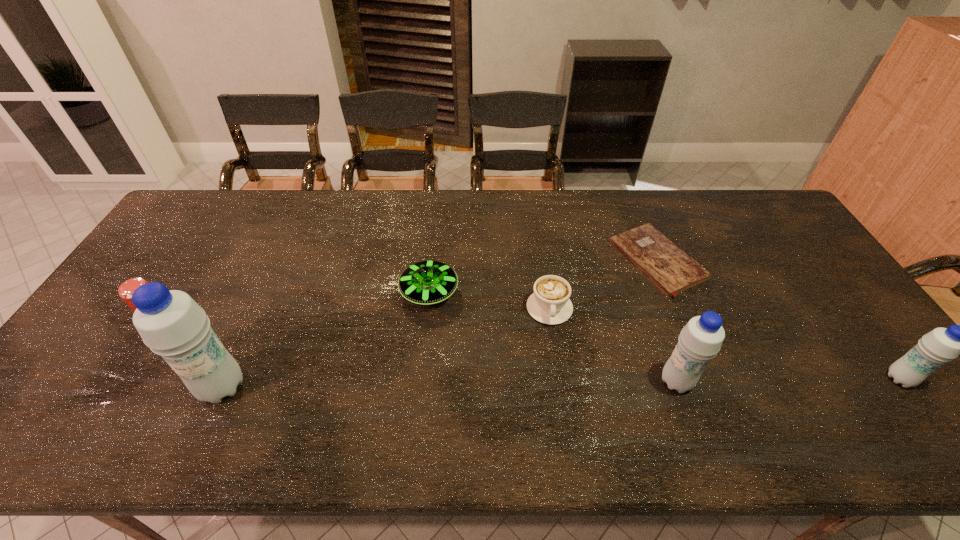
In order to click on the tallest object in this screenshot , I will do `click(170, 323)`.

Locate an element on the screen. the leftmost water bottle is located at coordinates (170, 323).

Find the location of `the second shortest water bottle`. the second shortest water bottle is located at coordinates (700, 340).

In order to click on the sixth shortest object in this screenshot , I will do `click(700, 340)`.

What are the coordinates of `the shortest water bottle` in the screenshot? It's located at (941, 345).

Where is `the third tallest object`? The image size is (960, 540). the third tallest object is located at coordinates (941, 345).

You are a GUI agent. You are given a task and a screenshot of the screen. Output one action in this format:
    pyautogui.click(x=<x>, y=<y>)
    Task: Click on the Bible
    
    Given the screenshot: What is the action you would take?
    pyautogui.click(x=670, y=269)

Locate an element on the screen. Image resolution: width=960 pixels, height=540 pixels. beer can is located at coordinates (126, 289).

Where is `the fourth shortest object`? The width and height of the screenshot is (960, 540). the fourth shortest object is located at coordinates (126, 289).

The width and height of the screenshot is (960, 540). Identify the location of the fifth object from right to left. (429, 282).